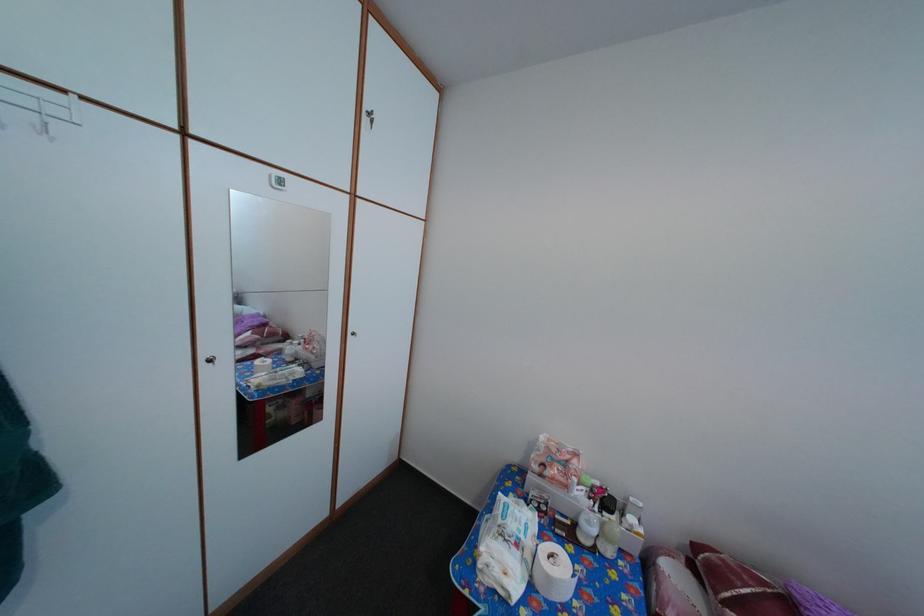
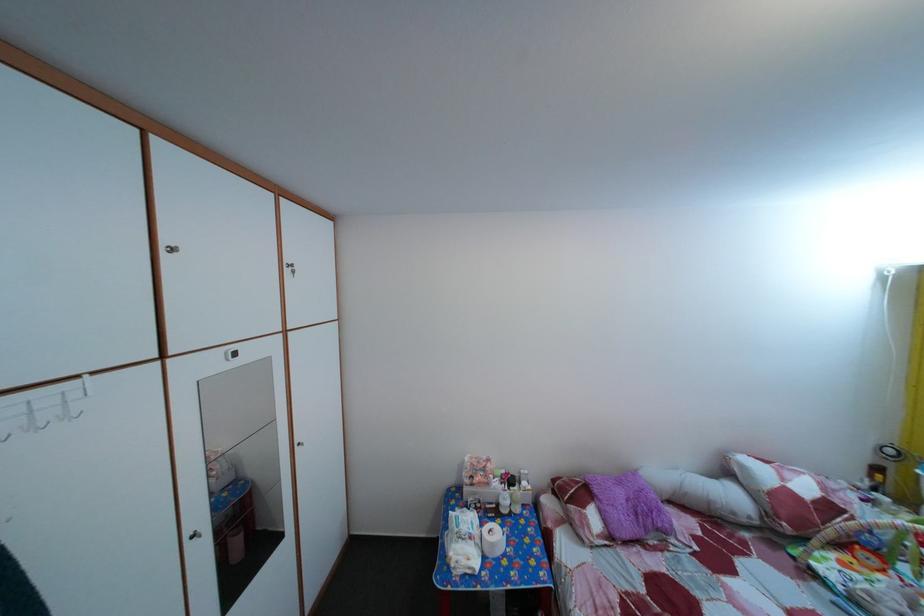
Question: The camera is either moving clockwise (left) or counter-clockwise (right) around the object. The first image is from the beginning of the video and the second image is from the end. Is the camera moving left or right when shooting the video?

Choices:
 (A) Left
 (B) Right

Answer: (A)